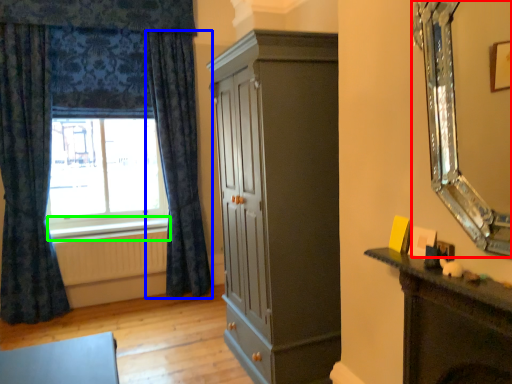
Question: Which is farther away from mirror (highlighted by a red box)? curtain (highlighted by a blue box) or window sill (highlighted by a green box)?

Choices:
 (A) curtain
 (B) window sill

Answer: (B)